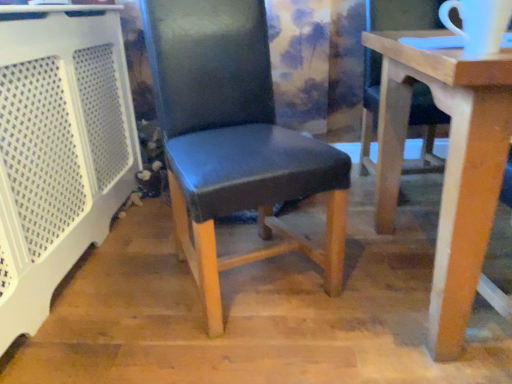
Question: Does point (130, 137) appear closer or farther from the camera than point (210, 246)?

Choices:
 (A) farther
 (B) closer

Answer: (A)

Question: Choose the correct answer: Is white perforated plastic at left inside black leather chair at center, marked as the first chair in a left-to-right arrangement, or outside it?

Choices:
 (A) outside
 (B) inside

Answer: (A)

Question: Considering the real-world distances, which object is closest to the black leather chair at center, placed as the second chair when sorted from right to left?

Choices:
 (A) white perforated plastic at left
 (B) matte black chair at center, acting as the first chair starting from the right

Answer: (A)

Question: Which object is the closest to the matte black chair at center, acting as the first chair starting from the right?

Choices:
 (A) white perforated plastic at left
 (B) black leather chair at center, placed as the second chair when sorted from right to left

Answer: (B)